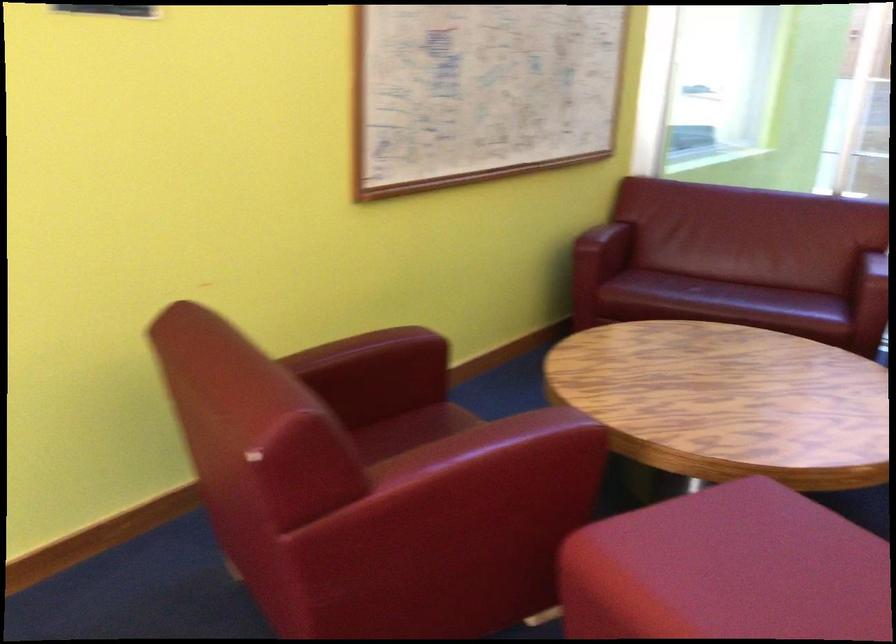
Find where to sit the sofa sitting surface. Please return your answer as a coordinate pair (x, y).

(719, 297)